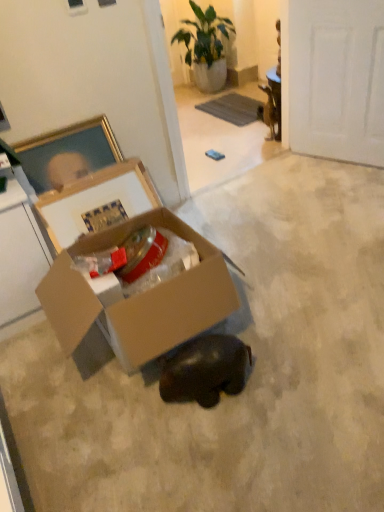
Where is `vacant area that is in front of white matte door at upper right`? This screenshot has width=384, height=512. vacant area that is in front of white matte door at upper right is located at coordinates (343, 184).